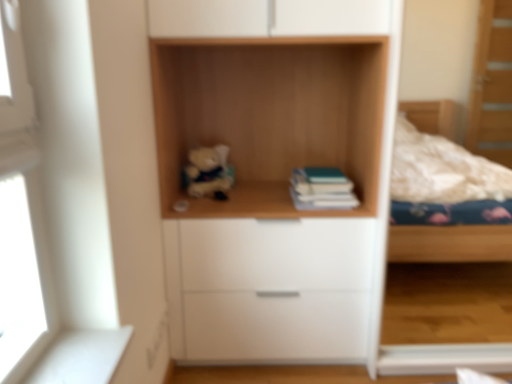
Question: Is soft plush bear at center at the right side of white matte drawer at center?

Choices:
 (A) yes
 (B) no

Answer: (B)

Question: Considering the relative sizes of soft plush bear at center and white matte drawer at center in the image provided, is soft plush bear at center smaller than white matte drawer at center?

Choices:
 (A) yes
 (B) no

Answer: (A)

Question: Is soft plush bear at center bigger than white matte drawer at center?

Choices:
 (A) no
 (B) yes

Answer: (A)

Question: Could you tell me if soft plush bear at center is turned towards white matte drawer at center?

Choices:
 (A) no
 (B) yes

Answer: (A)

Question: Is soft plush bear at center at the left side of white matte drawer at center?

Choices:
 (A) yes
 (B) no

Answer: (A)

Question: Is teal matte book at center inside or outside of white matte drawer at center?

Choices:
 (A) inside
 (B) outside

Answer: (B)

Question: Considering the positions of point (336, 173) and point (183, 231), is point (336, 173) closer or farther from the camera than point (183, 231)?

Choices:
 (A) farther
 (B) closer

Answer: (A)

Question: Considering the relative positions of teal matte book at center and white matte drawer at center in the image provided, is teal matte book at center to the left or to the right of white matte drawer at center?

Choices:
 (A) left
 (B) right

Answer: (B)

Question: From the image's perspective, is teal matte book at center above or below white matte drawer at center?

Choices:
 (A) above
 (B) below

Answer: (A)

Question: From a real-world perspective, is soft plush bear at center above or below teal matte book at center?

Choices:
 (A) below
 (B) above

Answer: (B)

Question: Considering the positions of soft plush bear at center and teal matte book at center in the image, is soft plush bear at center taller or shorter than teal matte book at center?

Choices:
 (A) short
 (B) tall

Answer: (B)

Question: Is soft plush bear at center wider or thinner than teal matte book at center?

Choices:
 (A) wide
 (B) thin

Answer: (B)

Question: Considering the positions of soft plush bear at center and teal matte book at center in the image, is soft plush bear at center bigger or smaller than teal matte book at center?

Choices:
 (A) small
 (B) big

Answer: (A)

Question: From a real-world perspective, is soft plush bear at center positioned above or below white matte drawer at center?

Choices:
 (A) above
 (B) below

Answer: (A)

Question: Is point (206, 160) positioned closer to the camera than point (343, 345)?

Choices:
 (A) closer
 (B) farther

Answer: (B)